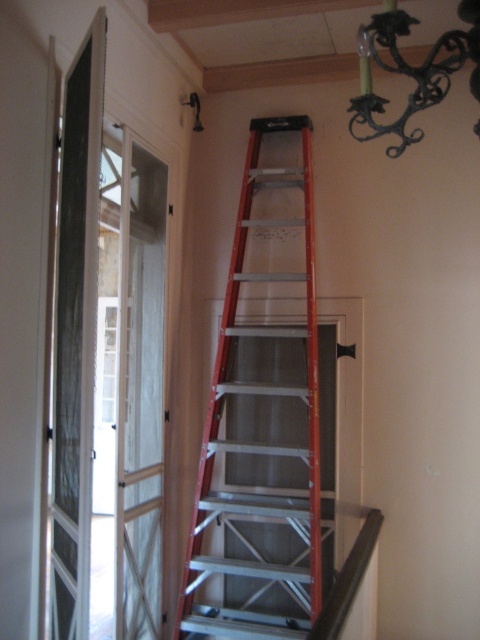
Question: Observing the image, what is the correct spatial positioning of orange metallic ladder at center in reference to black wrought iron chandelier at upper right?

Choices:
 (A) above
 (B) below

Answer: (B)

Question: Among these objects, which one is nearest to the camera?

Choices:
 (A) orange metallic ladder at center
 (B) black wrought iron chandelier at upper right

Answer: (B)

Question: Can you confirm if orange metallic ladder at center is positioned to the right of black wrought iron chandelier at upper right?

Choices:
 (A) no
 (B) yes

Answer: (A)

Question: From the image, what is the correct spatial relationship of orange metallic ladder at center in relation to black wrought iron chandelier at upper right?

Choices:
 (A) right
 (B) left

Answer: (B)

Question: Which object appears farthest from the camera in this image?

Choices:
 (A) orange metallic ladder at center
 (B) black wrought iron chandelier at upper right

Answer: (A)